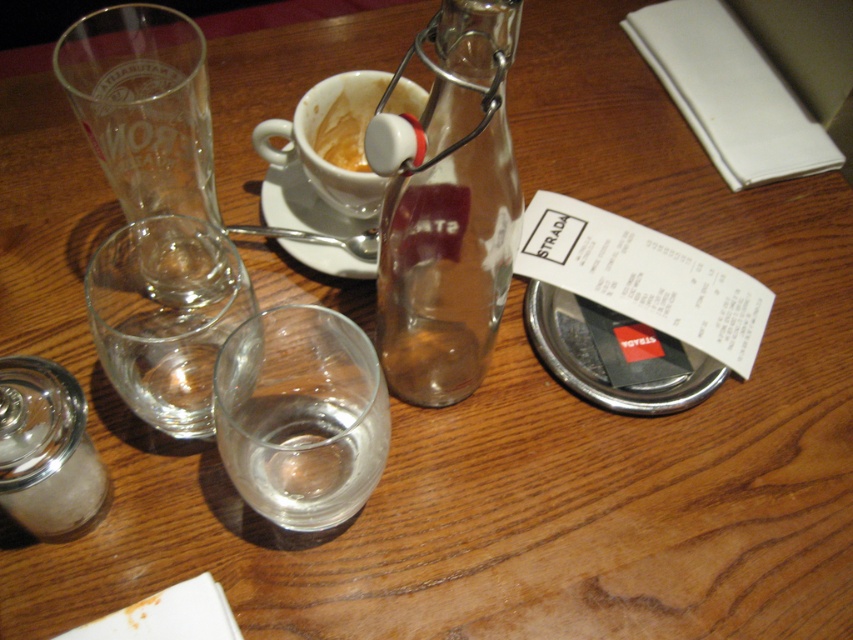
You are a customer at the table and want to grab the matte white cup at upper center to drink from it. Which object is directly above the transparent glass bottle at center that you need to move first?

The matte white cup at upper center is directly above the transparent glass bottle at center, so you need to move it first.

From the picture: You are a customer at this table and want to grab the transparent glass bottle at center. Which direction should you move your hand to reach it?

The transparent glass bottle at center is located at point coordinates 0.331 on the x axis and 0.530 on the y axis, so you should move your hand towards the center of the table to reach it.